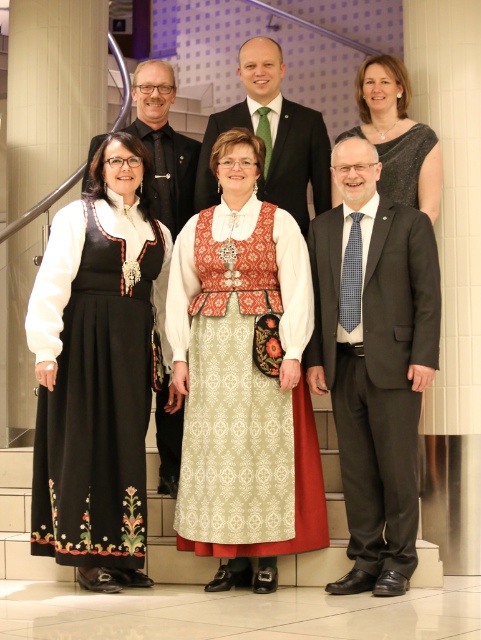
Is patterned fabric dress at center above green textured tie at upper center?

Incorrect, patterned fabric dress at center is not positioned above green textured tie at upper center.

Does patterned fabric dress at center appear under green textured tie at upper center?

Correct, patterned fabric dress at center is located below green textured tie at upper center.

At what (x,y) coordinates should I click in order to perform the action: click on patterned fabric dress at center. Please return your answer as a coordinate pair (x, y). The image size is (481, 640). Looking at the image, I should click on (242, 378).

Where is `patterned fabric dress at center`? The width and height of the screenshot is (481, 640). patterned fabric dress at center is located at coordinates (242, 378).

Describe the element at coordinates (242, 378) in the screenshot. I see `patterned fabric dress at center` at that location.

Is patterned fabric dress at center below black satin dress at upper center?

Indeed, patterned fabric dress at center is positioned under black satin dress at upper center.

Where is `patterned fabric dress at center`? patterned fabric dress at center is located at coordinates (242, 378).

Between point (63, 492) and point (136, 76), which one is positioned behind?

The point (136, 76) is more distant.

Can you confirm if black woven dress at lower left is positioned to the left of matte black suit at center?

Correct, you'll find black woven dress at lower left to the left of matte black suit at center.

Is point (76, 330) positioned behind point (190, 179)?

That is False.

The height and width of the screenshot is (640, 481). I want to click on black woven dress at lower left, so click(x=98, y=410).